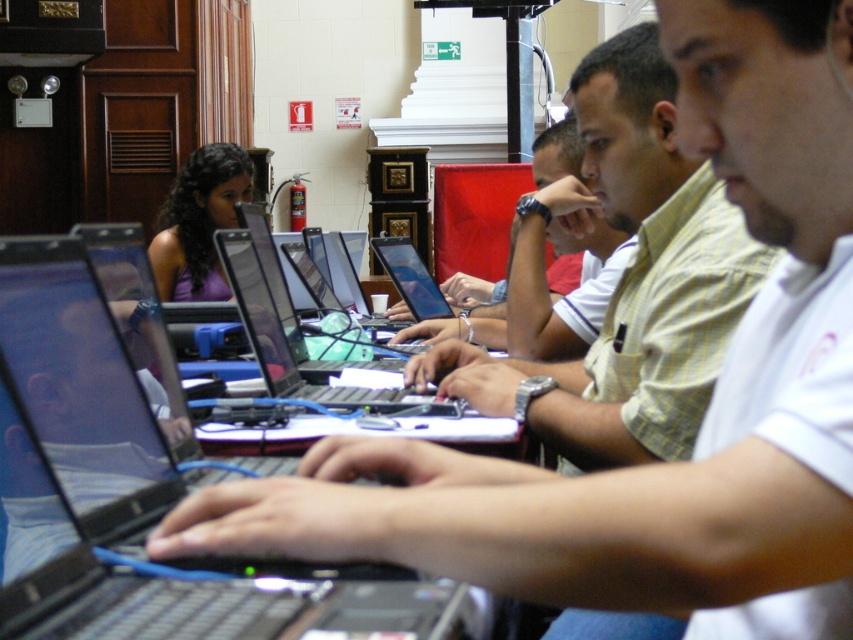
Question: Considering the relative positions of light yellow shirt at center and shiny black laptop at center in the image provided, where is light yellow shirt at center located with respect to shiny black laptop at center?

Choices:
 (A) below
 (B) above

Answer: (B)

Question: Which point is closer to the camera taking this photo?

Choices:
 (A) (225, 186)
 (B) (305, 394)

Answer: (B)

Question: Which point appears farthest from the camera in this image?

Choices:
 (A) (415, 396)
 (B) (372, 636)
 (C) (183, 273)
 (D) (303, 284)

Answer: (C)

Question: Is light yellow shirt at center bigger than shiny black laptop at center?

Choices:
 (A) yes
 (B) no

Answer: (A)

Question: Which is nearer to the light yellow shirt at center?

Choices:
 (A) silver metallic laptop at center
 (B) shiny black laptop at center
 (C) black glossy laptop at center
 (D) purple matte tank top at center

Answer: (A)

Question: Can you confirm if black glossy laptop at center is smaller than shiny black laptop at center?

Choices:
 (A) yes
 (B) no

Answer: (A)